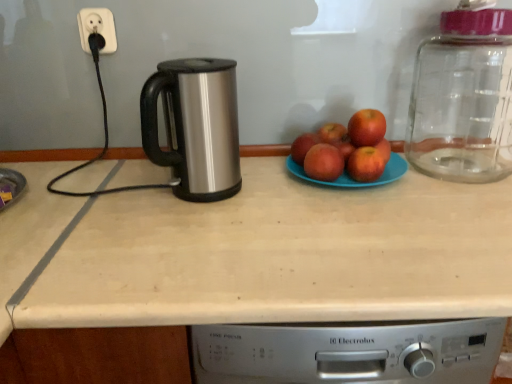
The image size is (512, 384). Find the location of `empty space that is to the right of polished stainless steel kettle at center`. empty space that is to the right of polished stainless steel kettle at center is located at coordinates (280, 194).